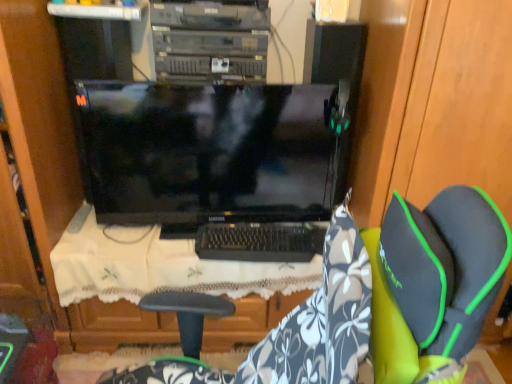
This screenshot has height=384, width=512. In order to click on vacant point above black plastic keyboard at center (from a real-world perspective) in this screenshot , I will do `click(256, 233)`.